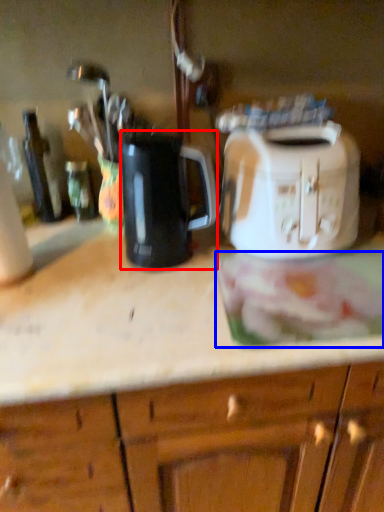
Question: Which of the following is the farthest to the observer, kitchen appliance (highlighted by a red box) or food (highlighted by a blue box)?

Choices:
 (A) kitchen appliance
 (B) food

Answer: (A)